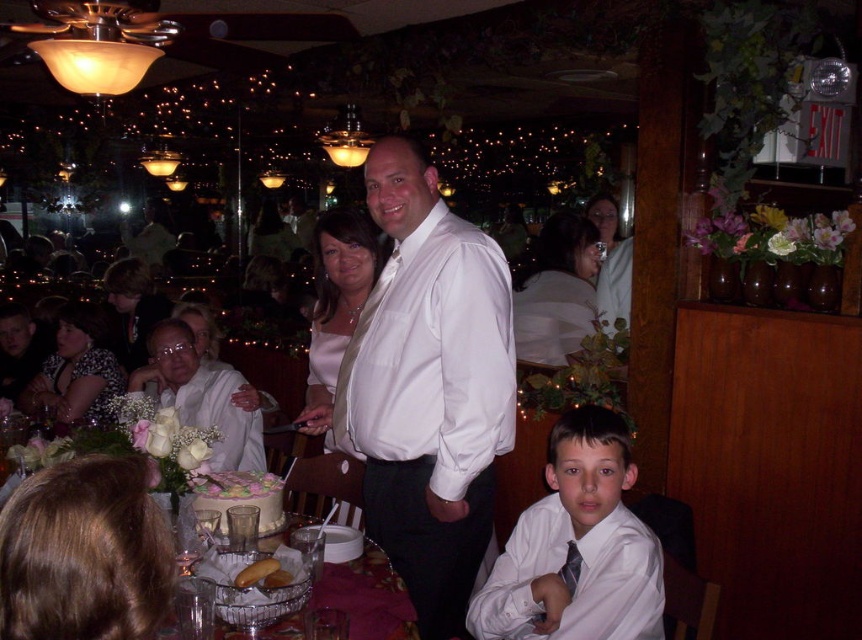
Is point (382, 280) positioned in front of point (606, 316)?

Yes.

Based on the photo, does white satin shirt at center lie in front of matte white blouse at upper right?

Yes, it is in front of matte white blouse at upper right.

Who is more distant from viewer, (403, 474) or (601, 294)?

The point (601, 294) is more distant.

At what (x,y) coordinates should I click in order to perform the action: click on white satin shirt at center. Please return your answer as a coordinate pair (x, y). This screenshot has height=640, width=862. Looking at the image, I should click on (429, 387).

Does metallic silver basket at lower center appear under floral-patterned blouse at left?

Yes, metallic silver basket at lower center is below floral-patterned blouse at left.

Is metallic silver basket at lower center to the right of floral-patterned blouse at left from the viewer's perspective?

Yes, metallic silver basket at lower center is to the right of floral-patterned blouse at left.

Between point (404, 608) and point (92, 408), which one is positioned behind?

Positioned behind is point (92, 408).

The height and width of the screenshot is (640, 862). I want to click on metallic silver basket at lower center, so pyautogui.click(x=355, y=600).

Can you confirm if white frosted cake at center is taller than golden bread at table center?

Indeed, white frosted cake at center has a greater height compared to golden bread at table center.

Locate an element on the screen. The width and height of the screenshot is (862, 640). white frosted cake at center is located at coordinates (244, 497).

Locate an element on the screen. white frosted cake at center is located at coordinates (244, 497).